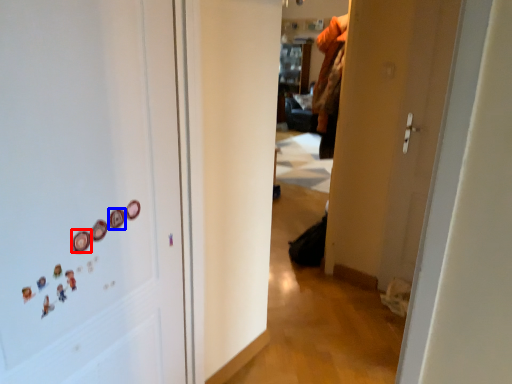
Question: Which object appears closest to the camera in this image, button (highlighted by a red box) or button (highlighted by a blue box)?

Choices:
 (A) button
 (B) button

Answer: (A)